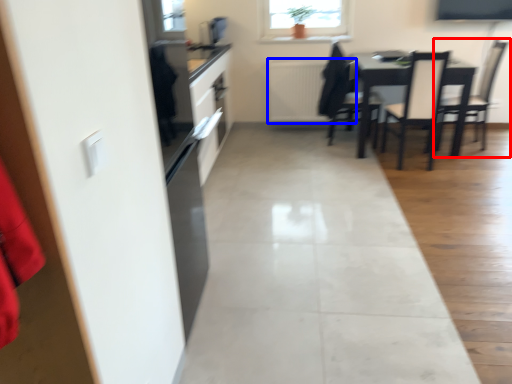
Question: Which object is further to the camera taking this photo, chair (highlighted by a red box) or radiator (highlighted by a blue box)?

Choices:
 (A) chair
 (B) radiator

Answer: (B)